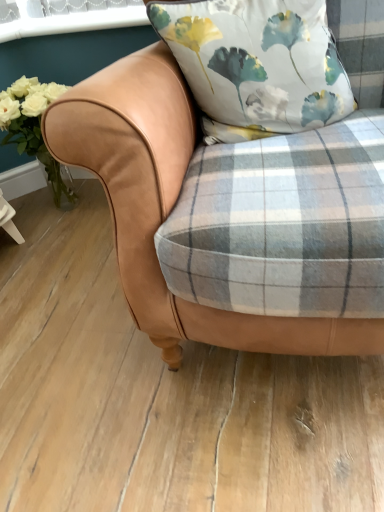
Question: In terms of size, does tan leather chair at center appear bigger or smaller than silky floral pillow at center?

Choices:
 (A) big
 (B) small

Answer: (A)

Question: From the image's perspective, is tan leather chair at center above or below silky floral pillow at center?

Choices:
 (A) below
 (B) above

Answer: (A)

Question: Estimate the real-world distances between objects in this image. Which object is closer to the white matte flowers at left?

Choices:
 (A) tan leather chair at center
 (B) white plastic window screen at upper left
 (C) silky floral pillow at center

Answer: (B)

Question: Based on their relative distances, which object is nearer to the white plastic window screen at upper left?

Choices:
 (A) tan leather chair at center
 (B) white matte flowers at left
 (C) silky floral pillow at center

Answer: (B)